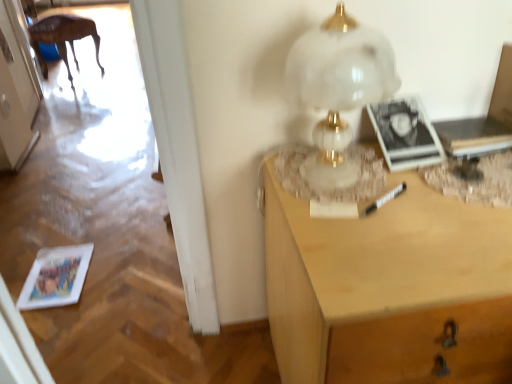
Question: From a real-world perspective, is light wood desk at right physically located above or below white glossy door at upper left?

Choices:
 (A) above
 (B) below

Answer: (B)

Question: From the image's perspective, is light wood desk at right positioned above or below white glossy door at upper left?

Choices:
 (A) above
 (B) below

Answer: (B)

Question: Which of these objects is positioned farthest from the white marble table lamp at upper right?

Choices:
 (A) light wood desk at right
 (B) wooden table at left
 (C) matte paper magazine at lower left
 (D) white glossy door at upper left

Answer: (B)

Question: Which of these objects is positioned farthest from the light wood desk at right?

Choices:
 (A) white glossy door at upper left
 (B) white marble table lamp at upper right
 (C) wooden table at left
 (D) matte paper magazine at lower left

Answer: (C)